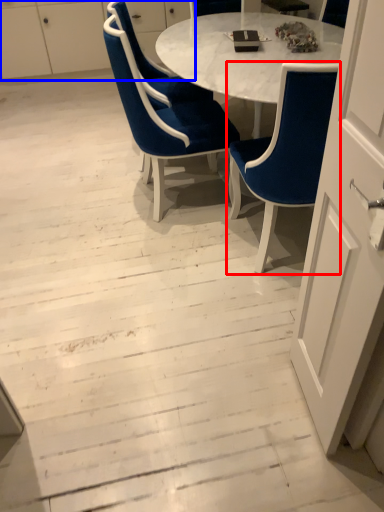
Question: Which object appears closest to the camera in this image, chair (highlighted by a red box) or dresser (highlighted by a blue box)?

Choices:
 (A) chair
 (B) dresser

Answer: (A)